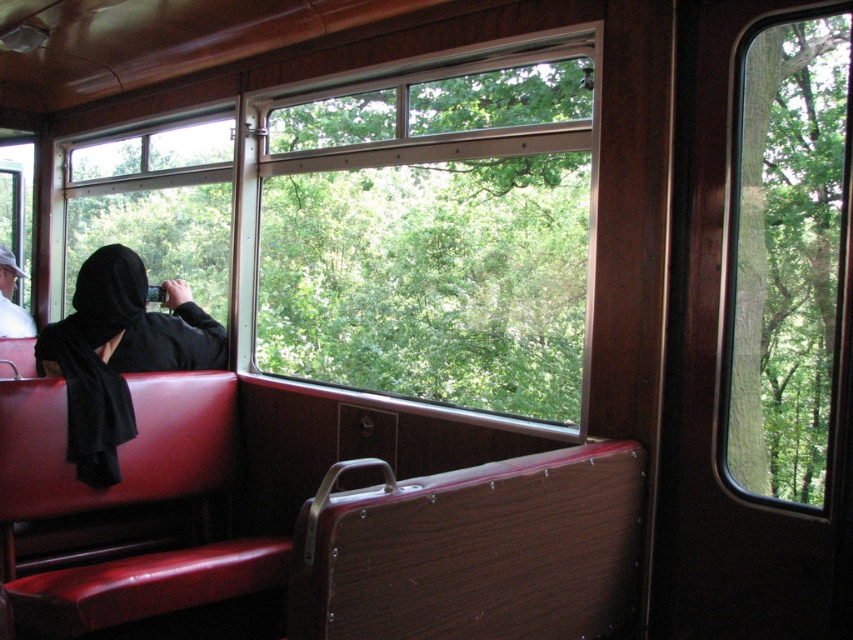
Question: Based on their relative distances, which object is nearer to the transparent glass window at right?

Choices:
 (A) dark gray hoodie at left
 (B) clear glass window at center
 (C) black matte robe at center

Answer: (C)

Question: Is clear glass window at left positioned at the back of black matte robe at center?

Choices:
 (A) yes
 (B) no

Answer: (A)

Question: Can you confirm if clear glass window at left is positioned above black matte robe at center?

Choices:
 (A) yes
 (B) no

Answer: (A)

Question: Among these points, which one is farthest from the camera?

Choices:
 (A) (67, 209)
 (B) (550, 156)
 (C) (120, 435)

Answer: (A)

Question: Which point is closer to the camera taking this photo?

Choices:
 (A) (131, 202)
 (B) (142, 332)

Answer: (B)

Question: Is clear glass window at center closer to camera compared to transparent glass window at right?

Choices:
 (A) yes
 (B) no

Answer: (B)